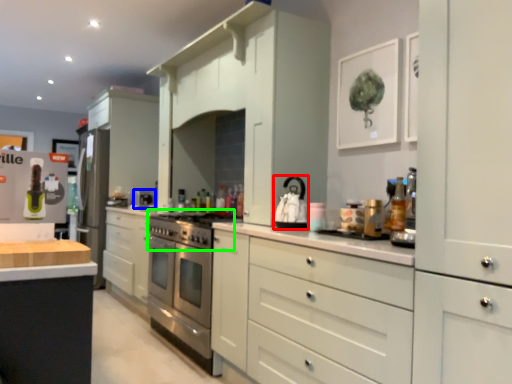
Question: Estimate the real-world distances between objects in this image. Which object is farther from appliance (highlighted by a red box), appliance (highlighted by a blue box) or gas stove (highlighted by a green box)?

Choices:
 (A) appliance
 (B) gas stove

Answer: (A)